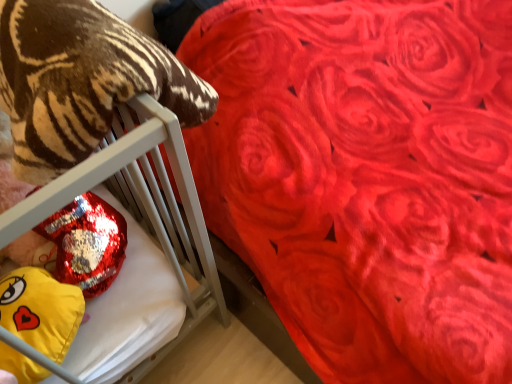
Question: From a real-world perspective, is yellow plush at left positioned above or below shiny metallic pillow at left?

Choices:
 (A) below
 (B) above

Answer: (B)

Question: Looking at the image, does yellow plush at left seem bigger or smaller compared to shiny metallic pillow at left?

Choices:
 (A) big
 (B) small

Answer: (B)

Question: Which is farther from the soft plush tiger at left?

Choices:
 (A) yellow plush at left
 (B) shiny metallic pillow at left

Answer: (A)

Question: Which is nearer to the shiny metallic pillow at left?

Choices:
 (A) yellow plush at left
 (B) soft plush tiger at left

Answer: (B)